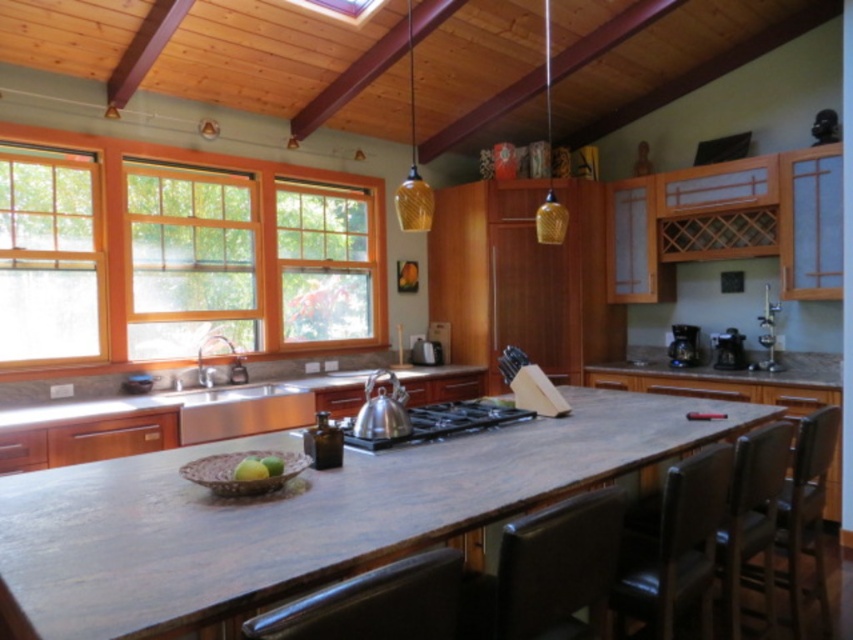
Measure the distance between brown polished wood at right and black plastic coffee maker at right.

brown polished wood at right is 23.58 centimeters from black plastic coffee maker at right.

Is brown polished wood at right to the left of black plastic coffee maker at right from the viewer's perspective?

Correct, you'll find brown polished wood at right to the left of black plastic coffee maker at right.

At what (x,y) coordinates should I click in order to perform the action: click on brown polished wood at right. Please return your answer as a coordinate pair (x, y). Looking at the image, I should click on (721, 369).

Locate an element on the screen. The height and width of the screenshot is (640, 853). wooden frame windows at upper left is located at coordinates (201, 243).

Describe the element at coordinates (201, 243) in the screenshot. I see `wooden frame windows at upper left` at that location.

What do you see at coordinates (201, 243) in the screenshot?
I see `wooden frame windows at upper left` at bounding box center [201, 243].

At what (x,y) coordinates should I click in order to perform the action: click on wooden frame windows at upper left. Please return your answer as a coordinate pair (x, y). Image resolution: width=853 pixels, height=640 pixels. Looking at the image, I should click on (201, 243).

Does brown leather chair at lower center have a smaller size compared to satin nickel toaster at center?

No.

Is point (296, 628) positioned behind point (425, 356)?

No, it is not.

At what (x,y) coordinates should I click in order to perform the action: click on brown leather chair at lower center. Please return your answer as a coordinate pair (x, y). This screenshot has height=640, width=853. Looking at the image, I should click on (374, 604).